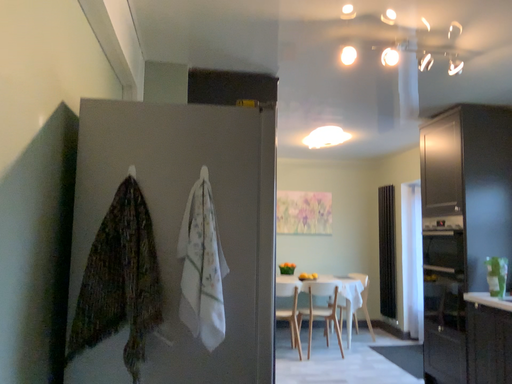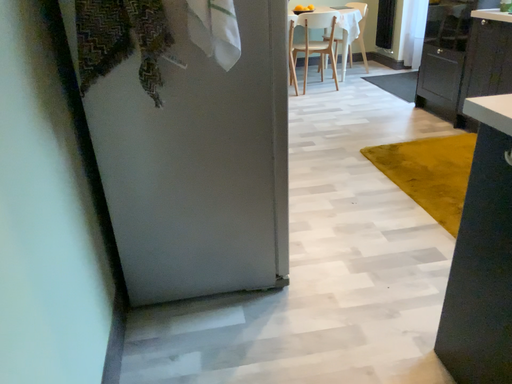
Question: How did the camera likely rotate when shooting the video?

Choices:
 (A) rotated downward
 (B) rotated upward

Answer: (A)